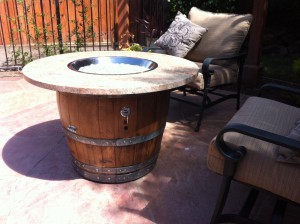
The width and height of the screenshot is (300, 224). What are the coordinates of `left armrest` in the screenshot? It's located at (267, 138), (219, 58).